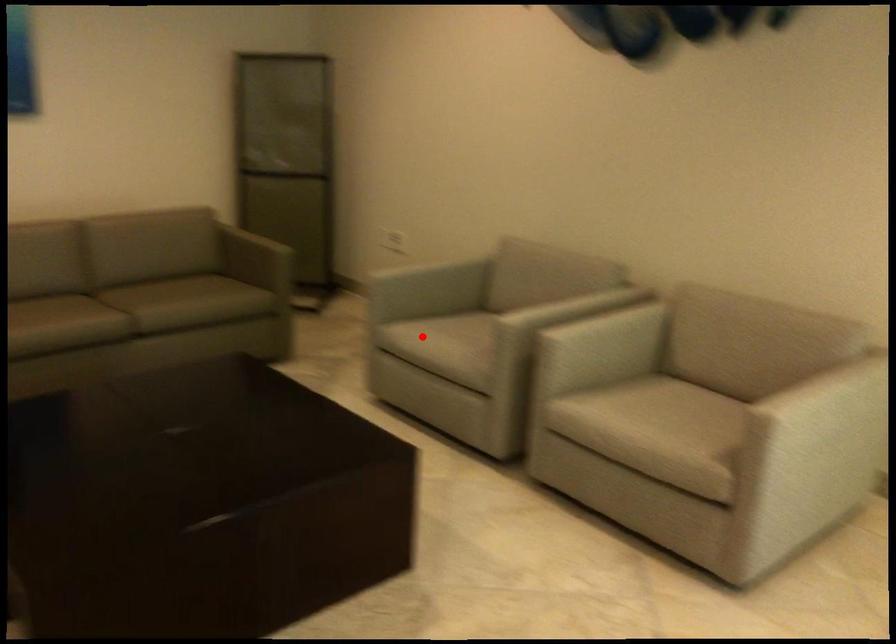
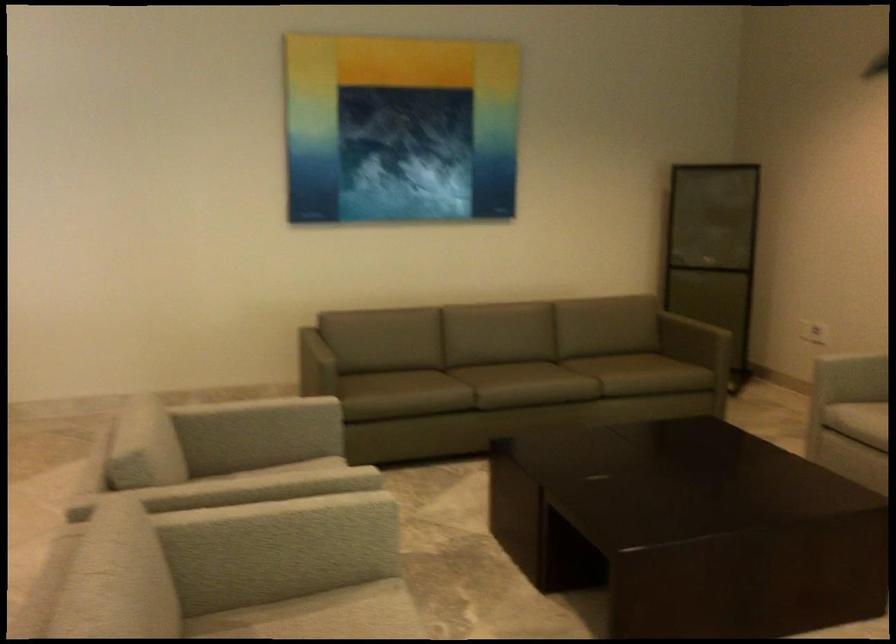
Question: I am providing you with two images of the same scene from different viewpoints. A red point is marked on the first image. Can you still see the location of the red point in image 2?

Choices:
 (A) Yes
 (B) No

Answer: (A)